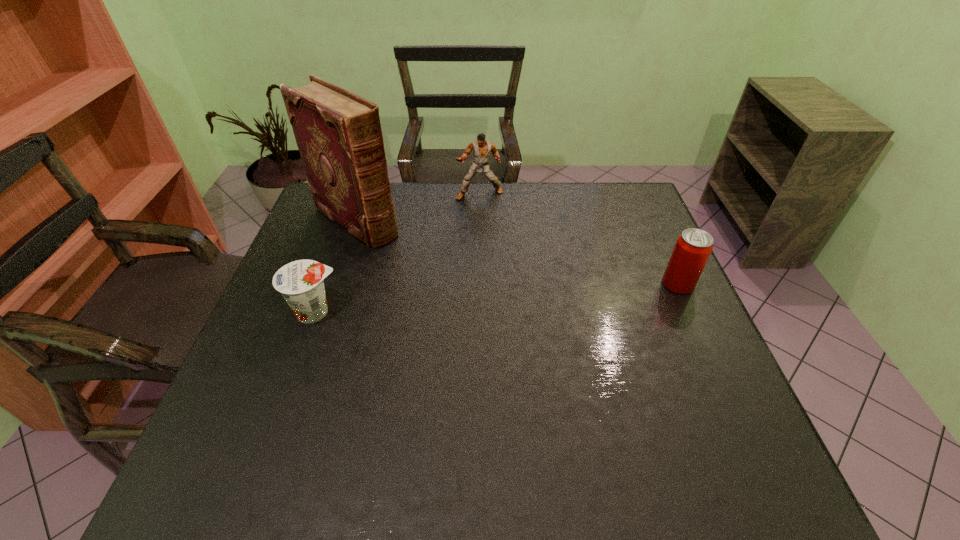
Locate an element on the screen. yogurt is located at coordinates (300, 282).

Locate an element on the screen. Image resolution: width=960 pixels, height=540 pixels. can is located at coordinates (693, 247).

Find the location of a particular element. The image size is (960, 540). the second shortest object is located at coordinates (693, 247).

Locate an element on the screen. puncher is located at coordinates (482, 149).

You are a GUI agent. You are given a task and a screenshot of the screen. Output one action in this format:
    pyautogui.click(x=<x>, y=<y>)
    Task: Click on the third object from left to right
    This screenshot has width=960, height=540.
    Given the screenshot: What is the action you would take?
    pyautogui.click(x=482, y=149)

The image size is (960, 540). I want to click on hardback book, so click(339, 136).

At what (x,y) coordinates should I click in order to perform the action: click on free region located on the front of the yogurt. Please return your answer as a coordinate pair (x, y). The image size is (960, 540). Looking at the image, I should click on (299, 361).

I want to click on vacant space located 0.190m on the left of the rightmost object, so click(590, 284).

The image size is (960, 540). What are the coordinates of `free location located 0.330m on the front-facing side of the second tallest object` in the screenshot? It's located at (489, 271).

Locate an element on the screen. This screenshot has height=540, width=960. vacant space located on the front-facing side of the second tallest object is located at coordinates (486, 250).